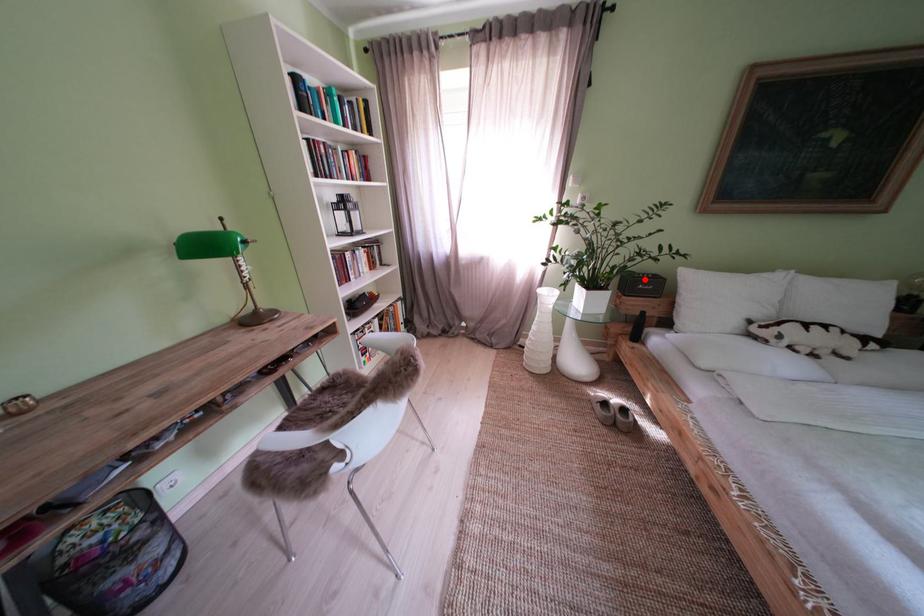
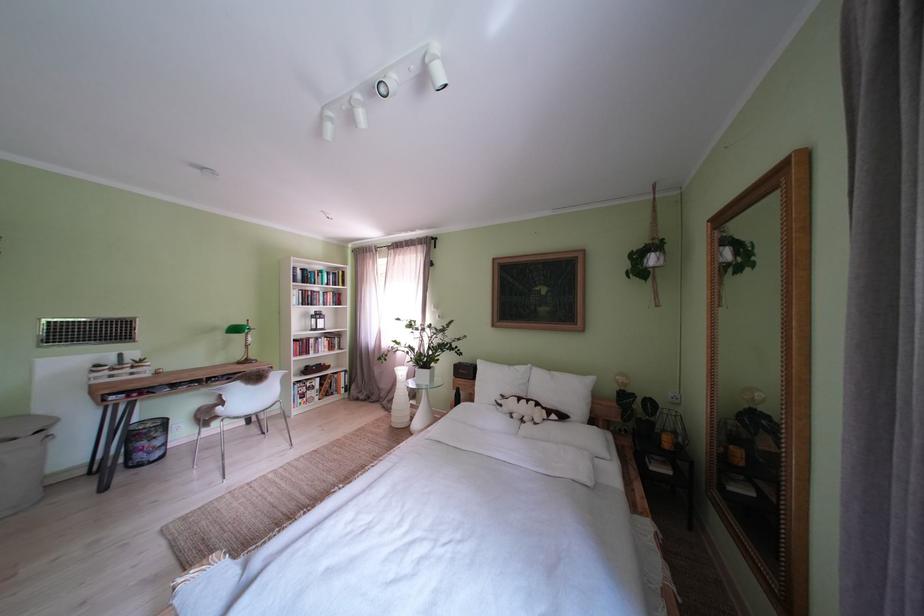
Find the pixel in the second image that matches the highlighted location in the first image.

(472, 369)